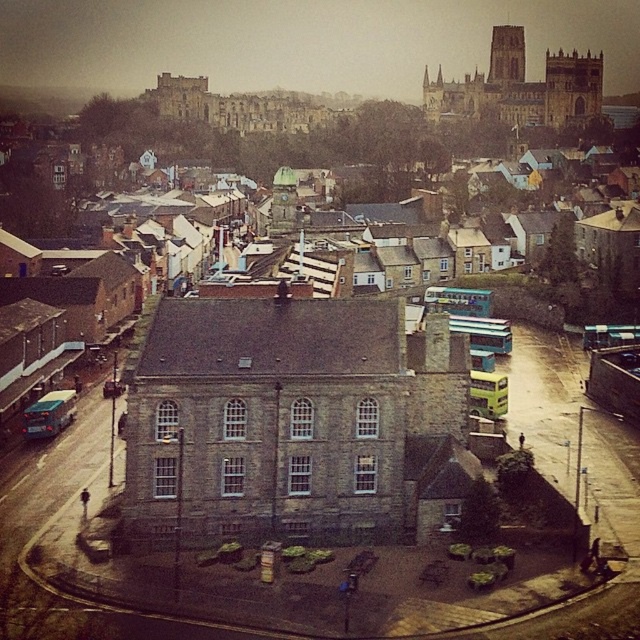
Question: Can you confirm if dark stone tower at upper right is positioned below dark stone tower at upper center?

Choices:
 (A) no
 (B) yes

Answer: (B)

Question: Does stone cathedral at upper right appear on the right side of dark stone tower at upper center?

Choices:
 (A) yes
 (B) no

Answer: (B)

Question: Is stone cathedral at upper right thinner than dark stone tower at upper right?

Choices:
 (A) no
 (B) yes

Answer: (A)

Question: Which point is farther to the camera?

Choices:
 (A) (582, 90)
 (B) (588, 97)
 (C) (500, 36)

Answer: (C)

Question: Which object appears closest to the camera in this image?

Choices:
 (A) dark stone tower at upper right
 (B) dark stone tower at upper center

Answer: (A)

Question: Which point is farther to the camera?

Choices:
 (A) dark stone tower at upper right
 (B) stone cathedral at upper right

Answer: (A)